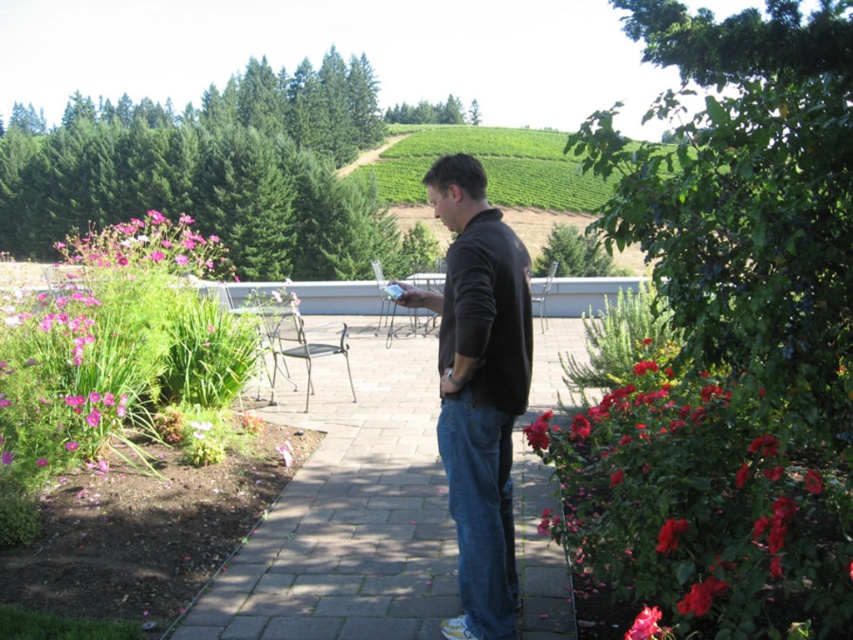
Is point (41, 401) positioned before point (650, 621)?

No, (41, 401) is behind (650, 621).

Which is behind, point (96, 314) or point (633, 625)?

The point (96, 314) is behind.

Which is in front, point (30, 394) or point (635, 621)?

Point (635, 621) is in front.

The height and width of the screenshot is (640, 853). What are the coordinates of `pink matte flowers at left` in the screenshot? It's located at (115, 344).

Who is positioned more to the left, dark brown leather jacket at center or red matte rose at center right?

From the viewer's perspective, dark brown leather jacket at center appears more on the left side.

Locate an element on the screen. dark brown leather jacket at center is located at coordinates (479, 388).

Identify the location of dark brown leather jacket at center. The image size is (853, 640). (479, 388).

Does red matte rose bush at lower right have a smaller size compared to smooth pink rose at center right?

Actually, red matte rose bush at lower right might be larger than smooth pink rose at center right.

Who is shorter, red matte rose bush at lower right or smooth pink rose at center right?

With less height is smooth pink rose at center right.

Is point (729, 465) positioned in front of point (538, 433)?

That is True.

Image resolution: width=853 pixels, height=640 pixels. I want to click on red matte rose bush at lower right, so click(699, 509).